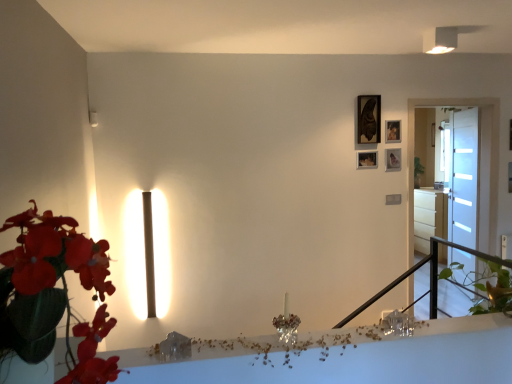
Question: Is crystal glass candle at center in front of white glossy drawer at right, acting as the 2th table starting from the bottom?

Choices:
 (A) yes
 (B) no

Answer: (A)

Question: Considering the relative sizes of crystal glass candle at center and white glossy drawer at right, the 1th table in the right-to-left sequence, in the image provided, is crystal glass candle at center smaller than white glossy drawer at right, the 1th table in the right-to-left sequence,?

Choices:
 (A) yes
 (B) no

Answer: (A)

Question: Is crystal glass candle at center facing away from white glossy drawer at right, marked as the 1th table in a top-to-bottom arrangement?

Choices:
 (A) yes
 (B) no

Answer: (B)

Question: Is crystal glass candle at center positioned far away from white glossy drawer at right, marked as the 1th table in a top-to-bottom arrangement?

Choices:
 (A) yes
 (B) no

Answer: (A)

Question: From the image's perspective, is crystal glass candle at center located above white glossy drawer at right, acting as the 2th table starting from the bottom?

Choices:
 (A) no
 (B) yes

Answer: (A)

Question: From the image's perspective, is white frosted glass door at right, placed as the 1th glass door when sorted from back to front, located above or below matte black picture frame at upper right, arranged as the fourth picture frame when viewed from the top?

Choices:
 (A) above
 (B) below

Answer: (B)

Question: From a real-world perspective, is white frosted glass door at right, placed as the 1th glass door when sorted from back to front, physically located above or below matte black picture frame at upper right, arranged as the fourth picture frame when viewed from the top?

Choices:
 (A) below
 (B) above

Answer: (A)

Question: Is white frosted glass door at right, acting as the 2th glass door starting from the front, in front of or behind matte black picture frame at upper right, arranged as the fourth picture frame when viewed from the top, in the image?

Choices:
 (A) behind
 (B) front

Answer: (A)

Question: Does point 459,235 appear closer or farther from the camera than point 368,155?

Choices:
 (A) closer
 (B) farther

Answer: (B)

Question: Relative to white frosted glass door at right, placed as the 1th glass door when sorted from back to front, is leather-like green plant at left in front or behind?

Choices:
 (A) behind
 (B) front

Answer: (B)

Question: In terms of size, does leather-like green plant at left appear bigger or smaller than white frosted glass door at right, placed as the 1th glass door when sorted from back to front?

Choices:
 (A) big
 (B) small

Answer: (A)

Question: From the image's perspective, is leather-like green plant at left above or below white frosted glass door at right, placed as the 1th glass door when sorted from back to front?

Choices:
 (A) below
 (B) above

Answer: (A)

Question: Considering the positions of leather-like green plant at left and white frosted glass door at right, placed as the 1th glass door when sorted from back to front, in the image, is leather-like green plant at left wider or thinner than white frosted glass door at right, placed as the 1th glass door when sorted from back to front,?

Choices:
 (A) wide
 (B) thin

Answer: (A)

Question: From the image's perspective, is matte black picture frame at upper right, the fourth picture frame when ordered from bottom to top, positioned above or below matte black picture frame at upper right, the 1th picture frame ordered from the bottom?

Choices:
 (A) above
 (B) below

Answer: (A)

Question: Is matte black picture frame at upper right, the fourth picture frame when ordered from bottom to top, wider or thinner than matte black picture frame at upper right, arranged as the fourth picture frame when viewed from the top?

Choices:
 (A) wide
 (B) thin

Answer: (A)